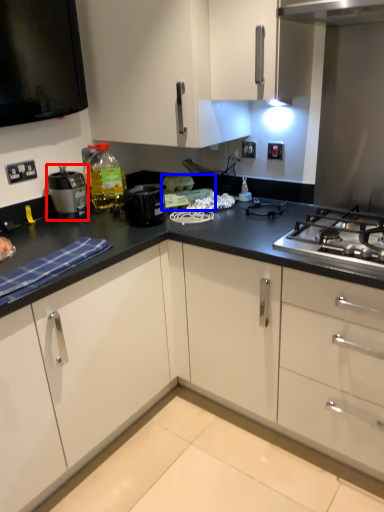
Question: Which of the following is the closest to the observer, kitchen appliance (highlighted by a red box) or appliance (highlighted by a blue box)?

Choices:
 (A) kitchen appliance
 (B) appliance

Answer: (A)